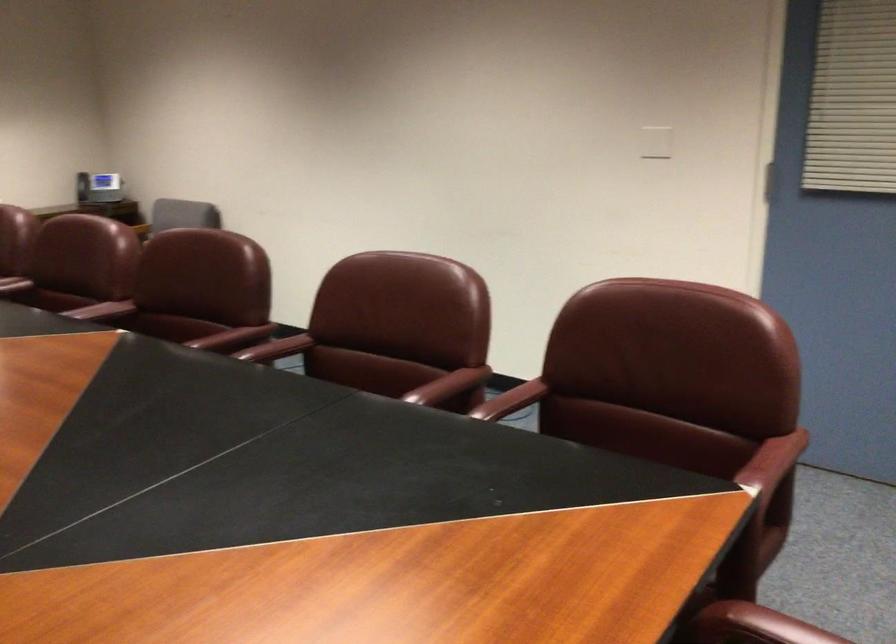
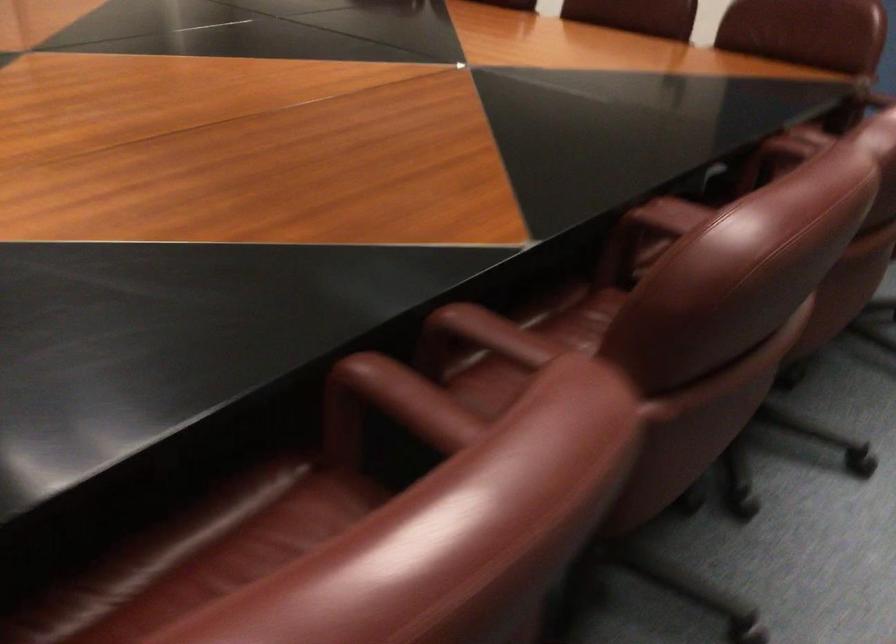
Find the pixel in the second image that matches (222,325) in the first image.

(528, 344)